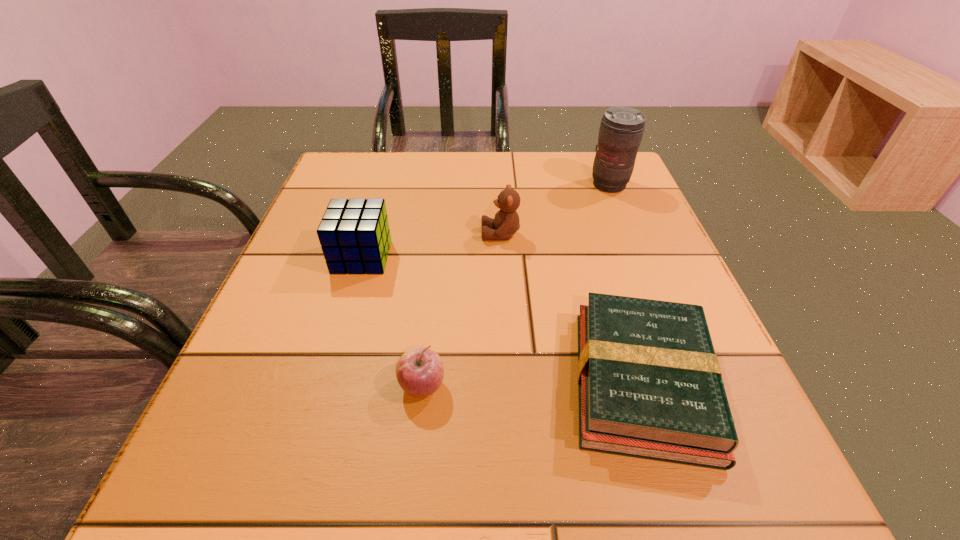
Identify the location of free space that satisfies the following two spatial constraints: 1. on the side of the telephoto lens where the control switches are located; 2. on the face of the third object from right to left. This screenshot has width=960, height=540. (629, 234).

This screenshot has height=540, width=960. Identify the location of free space that satisfies the following two spatial constraints: 1. on the face of the teddy bear; 2. on the right side of the shortest object. (509, 382).

Locate an element on the screen. vacant space that satisfies the following two spatial constraints: 1. on the side of the farthest object where the control switches are located; 2. on the face of the third object from right to left is located at coordinates (629, 234).

The height and width of the screenshot is (540, 960). What are the coordinates of `vacant region that satisfies the following two spatial constraints: 1. on the face of the teddy bear; 2. on the back side of the hardback book` in the screenshot? It's located at (509, 382).